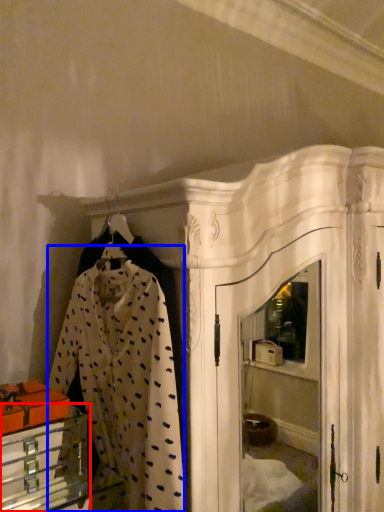
Question: Which object appears closest to the camera in this image, furniture (highlighted by a red box) or clothing (highlighted by a blue box)?

Choices:
 (A) furniture
 (B) clothing

Answer: (B)